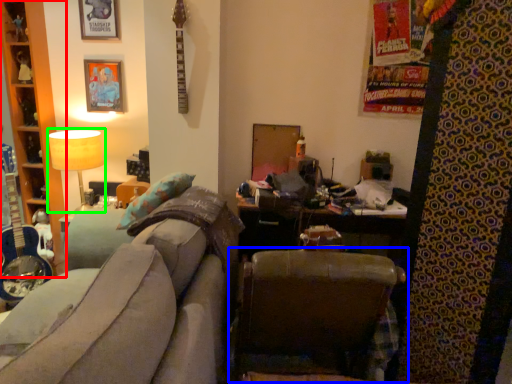
Question: Which object is the farthest from cabinet (highlighted by a red box)? Choose among these: chair (highlighted by a blue box) or table lamp (highlighted by a green box).

Choices:
 (A) chair
 (B) table lamp

Answer: (A)